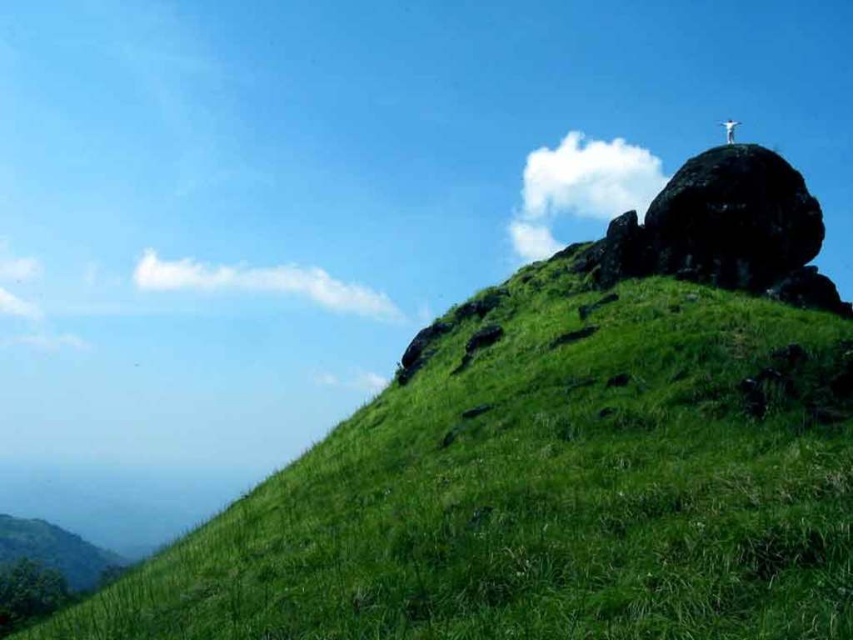
You are a hiker who has reached the top of the hill and wants to take a photo of the dark gray rocky outcrop at upper right. You are currently standing at point (724, 230). Is the dark gray rocky outcrop at upper right visible from your current position?

Yes, the dark gray rocky outcrop at upper right is located at point (724, 230), so you are standing directly on it and can clearly see it.

Based on the photo, you are a hiker who wants to place a marker at the point labeled as point (544, 486). Based on the scene, where exactly on the green grassy hillside at upper right should you place it?

The point (544, 486) is located on the green grassy hillside at upper right, so you should place the marker there.

You are planning to hike to the white stone cross at upper right. From your current position at the base of the green grassy hillside at upper right, which direction should you head to reach the cross?

The white stone cross at upper right is located above the green grassy hillside at upper right, so you should head upwards from the green grassy hillside at upper right to reach the cross.